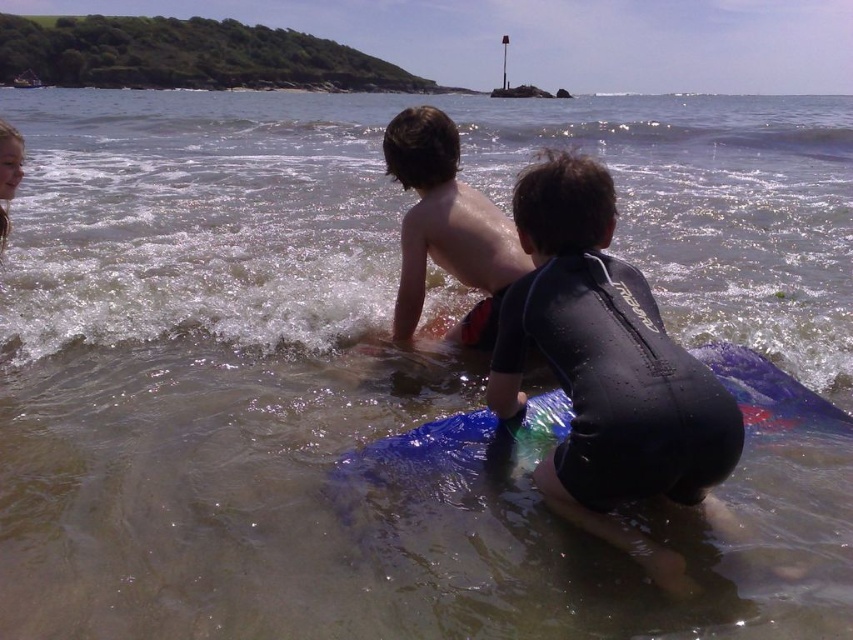
Question: Does black wetsuit at center have a larger size compared to shiny wet skin at center?

Choices:
 (A) yes
 (B) no

Answer: (B)

Question: Considering the relative positions of black wetsuit at center and shiny wet skin at center in the image provided, where is black wetsuit at center located with respect to shiny wet skin at center?

Choices:
 (A) left
 (B) right

Answer: (B)

Question: Is black wetsuit at center wider than shiny wet skin at center?

Choices:
 (A) no
 (B) yes

Answer: (B)

Question: Which of the following is the farthest from the observer?

Choices:
 (A) shiny wet skin at center
 (B) black wetsuit at center
 (C) blue rubber surfboard at lower center

Answer: (A)

Question: Which point is closer to the camera?

Choices:
 (A) blue rubber surfboard at lower center
 (B) shiny wet skin at center
 (C) black wetsuit at center

Answer: (C)

Question: Considering the real-world distances, which object is farthest from the blue rubber surfboard at lower center?

Choices:
 (A) black wetsuit at center
 (B) shiny wet skin at center

Answer: (B)